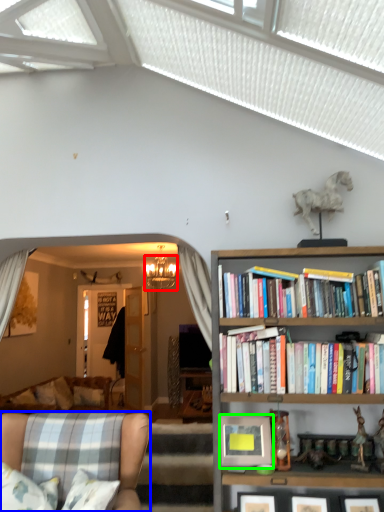
Question: Which object is positioned closest to lamp (highlighted by a red box)? Select from chair (highlighted by a blue box) and picture frame (highlighted by a green box).

Choices:
 (A) chair
 (B) picture frame

Answer: (A)